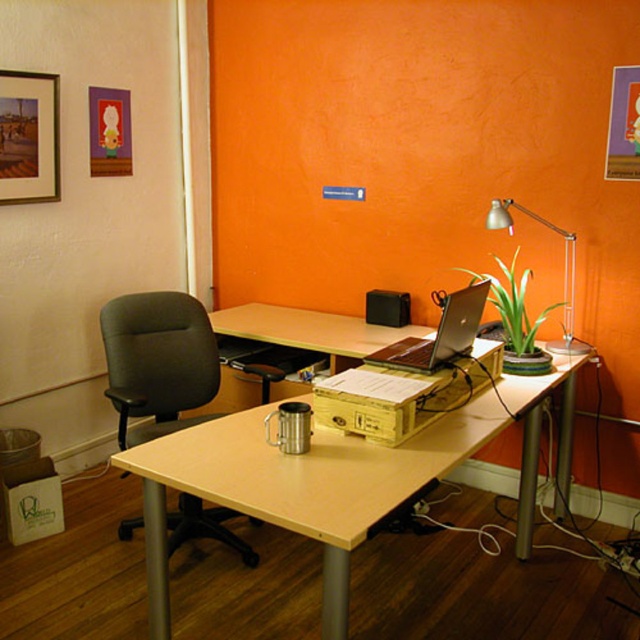
You are organizing your home office and want to place a new decoration between the matte orange picture frame at upper right and the metallic silver desk lamp at upper right. Based on their current positions, where should you place the new decoration to ensure it is centered between them?

The matte orange picture frame at upper right is positioned on the right side of metallic silver desk lamp at upper right. To center the new decoration between them, place it between the two objects, closer to the metallic silver desk lamp at upper right since the picture frame is to its right.

You are sitting in the black leather swivel chair at left and want to reach the metallic silver desk lamp at upper right. Which direction should you turn your body to face the desk lamp?

You should turn your body to the right because the metallic silver desk lamp at upper right is located to the right of the black leather swivel chair at left.

You are organizing a small gathering in the home office and need to arrange chairs around the desk. The metallic silver desk lamp at upper right is already placed. Considering the space, can the black leather swivel chair at left fit comfortably next to it without being too cramped?

The black leather swivel chair at left has a lesser width compared to the metallic silver desk lamp at upper right, so it should fit comfortably next to it without causing overcrowding.